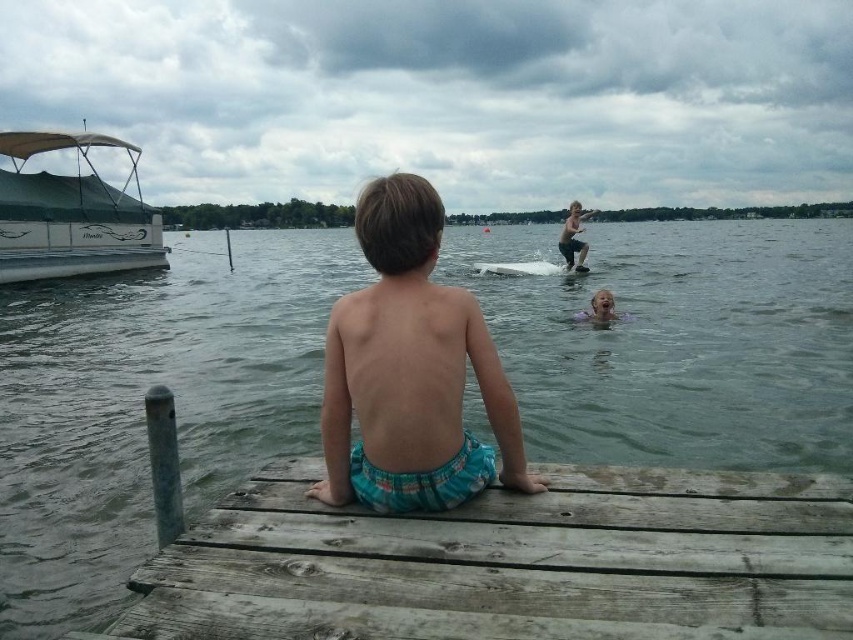
Between clear water at center and turquoise printed shorts at center, which one has more height?

clear water at center is taller.

In the scene shown: Is clear water at center above turquoise printed shorts at center?

Indeed, clear water at center is positioned over turquoise printed shorts at center.

This screenshot has height=640, width=853. Identify the location of clear water at center. (141, 404).

Is point (785, 598) positioned behind point (560, 244)?

No, it is not.

The height and width of the screenshot is (640, 853). Describe the element at coordinates (514, 563) in the screenshot. I see `weathered wood dock at center` at that location.

You are a GUI agent. You are given a task and a screenshot of the screen. Output one action in this format:
    pyautogui.click(x=<x>, y=<y>)
    Task: Click on the weathered wood dock at center
    Image resolution: width=853 pixels, height=640 pixels.
    Given the screenshot: What is the action you would take?
    pyautogui.click(x=514, y=563)

Where is `weathered wood dock at center`? This screenshot has height=640, width=853. weathered wood dock at center is located at coordinates (514, 563).

Is clear water at center bigger than white matte boat at upper left?

Indeed, clear water at center has a larger size compared to white matte boat at upper left.

Locate an element on the screen. The height and width of the screenshot is (640, 853). clear water at center is located at coordinates (141, 404).

Identify the location of clear water at center. (141, 404).